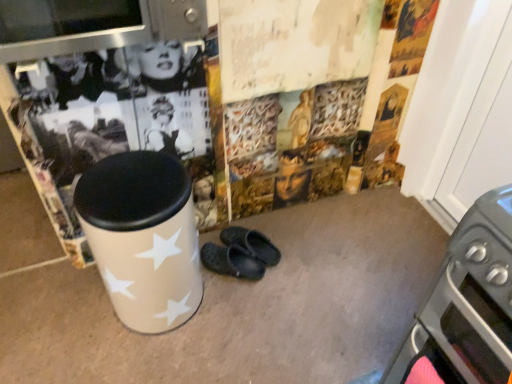
Question: Considering the relative positions of metallic stainless steel microwave at upper left and white glossy trash can at center in the image provided, is metallic stainless steel microwave at upper left to the left of white glossy trash can at center from the viewer's perspective?

Choices:
 (A) yes
 (B) no

Answer: (B)

Question: Is metallic stainless steel microwave at upper left oriented away from white glossy trash can at center?

Choices:
 (A) yes
 (B) no

Answer: (B)

Question: Considering the relative sizes of metallic stainless steel microwave at upper left and white glossy trash can at center in the image provided, is metallic stainless steel microwave at upper left smaller than white glossy trash can at center?

Choices:
 (A) yes
 (B) no

Answer: (A)

Question: Considering the relative positions of metallic stainless steel microwave at upper left and white glossy trash can at center in the image provided, is metallic stainless steel microwave at upper left to the right of white glossy trash can at center from the viewer's perspective?

Choices:
 (A) yes
 (B) no

Answer: (A)

Question: Does metallic stainless steel microwave at upper left have a lesser width compared to white glossy trash can at center?

Choices:
 (A) no
 (B) yes

Answer: (A)

Question: From a real-world perspective, is metallic stainless steel microwave at upper left positioned above or below black rubber clogs at center?

Choices:
 (A) above
 (B) below

Answer: (A)

Question: In terms of size, does metallic stainless steel microwave at upper left appear bigger or smaller than black rubber clogs at center?

Choices:
 (A) big
 (B) small

Answer: (A)

Question: Is metallic stainless steel microwave at upper left spatially inside black rubber clogs at center, or outside of it?

Choices:
 (A) outside
 (B) inside

Answer: (A)

Question: Is point tap(133, 9) positioned closer to the camera than point tap(242, 269)?

Choices:
 (A) farther
 (B) closer

Answer: (B)

Question: In terms of width, does metallic gray oven at lower right look wider or thinner when compared to metallic stainless steel microwave at upper left?

Choices:
 (A) wide
 (B) thin

Answer: (A)

Question: From a real-world perspective, is metallic gray oven at lower right above or below metallic stainless steel microwave at upper left?

Choices:
 (A) above
 (B) below

Answer: (B)

Question: From the image's perspective, is metallic gray oven at lower right located above or below metallic stainless steel microwave at upper left?

Choices:
 (A) above
 (B) below

Answer: (B)

Question: Based on their sizes in the image, would you say metallic gray oven at lower right is bigger or smaller than metallic stainless steel microwave at upper left?

Choices:
 (A) small
 (B) big

Answer: (B)

Question: Is point (438, 352) positioned closer to the camera than point (133, 160)?

Choices:
 (A) farther
 (B) closer

Answer: (B)

Question: Is metallic gray oven at lower right in front of or behind white glossy trash can at center in the image?

Choices:
 (A) front
 (B) behind

Answer: (A)